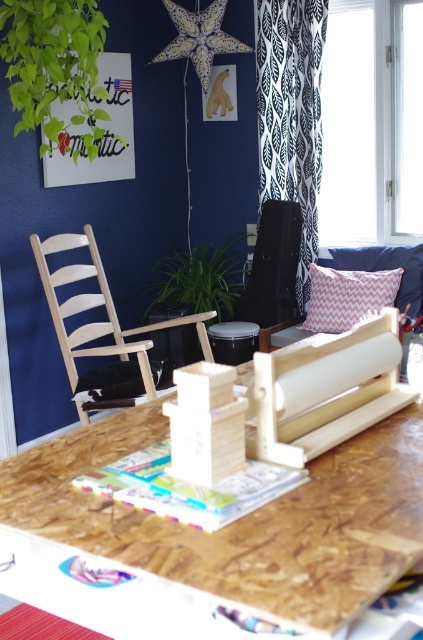
You are standing in the cozy corner of the room and want to take a photo of the point at coordinates (294, 49). The camera you are using has a focal length of 50mm. To ensure the point is in focus, what distance should you set the focus ring to?

The point at coordinates (294, 49) is 3.72 meters from the camera, so you should set the focus ring to 3.72 meters to ensure it is in focus.

You are an interior designer planning to hang a new painting between the black printed fabric curtain at upper right and the porcelain star at upper center. Based on their current positions, where should the painting be placed?

The painting should be placed between the porcelain star at upper center and the black printed fabric curtain at upper right since the curtain is positioned under the star.

You are sitting on the floor and looking up at the black leather chair at center and the white chevron pillow at center. Which object is positioned higher from your viewpoint?

The black leather chair at center is positioned higher than the white chevron pillow at center from your viewpoint.